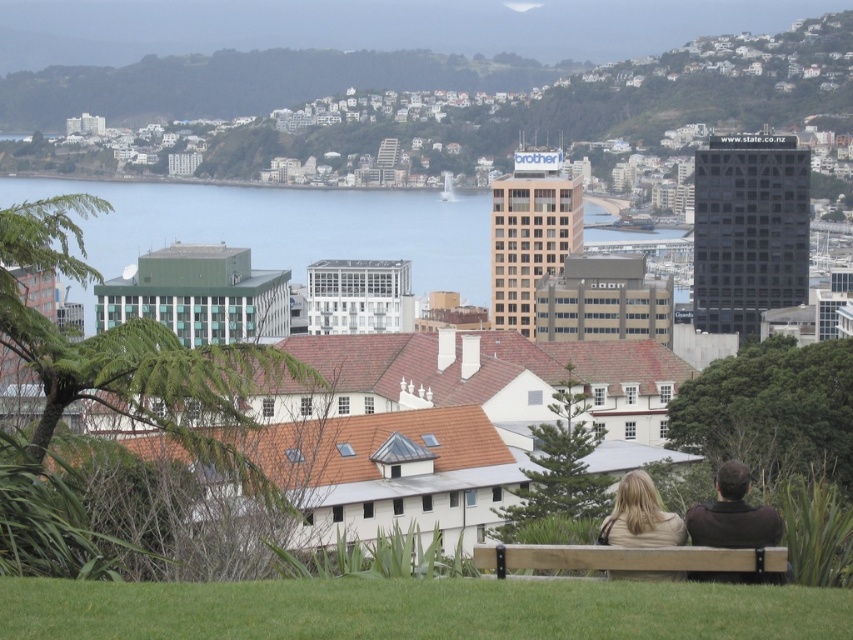
Who is taller, clear blue water at center or light brown leather jacket at lower center?

With more height is clear blue water at center.

Between clear blue water at center and light brown leather jacket at lower center, which one is positioned lower?

light brown leather jacket at lower center is lower down.

Which is in front, point (450, 276) or point (675, 531)?

Point (675, 531) is more forward.

You are a GUI agent. You are given a task and a screenshot of the screen. Output one action in this format:
    pyautogui.click(x=<x>, y=<y>)
    Task: Click on the clear blue water at center
    
    Given the screenshot: What is the action you would take?
    click(x=287, y=227)

Is clear blue water at center above light brown leather bench at lower center?

Indeed, clear blue water at center is positioned over light brown leather bench at lower center.

Measure the distance between clear blue water at center and camera.

They are 647.28 meters apart.

Describe the element at coordinates (287, 227) in the screenshot. I see `clear blue water at center` at that location.

Locate an element on the screen. Image resolution: width=853 pixels, height=640 pixels. clear blue water at center is located at coordinates (287, 227).

Can you confirm if brown wooden bench at lower center is smaller than light brown leather bench at lower center?

Indeed, brown wooden bench at lower center has a smaller size compared to light brown leather bench at lower center.

Can you confirm if brown wooden bench at lower center is positioned below light brown leather bench at lower center?

Yes, brown wooden bench at lower center is below light brown leather bench at lower center.

Where is `brown wooden bench at lower center`? Image resolution: width=853 pixels, height=640 pixels. brown wooden bench at lower center is located at coordinates (630, 560).

Where is `brown wooden bench at lower center`? brown wooden bench at lower center is located at coordinates (630, 560).